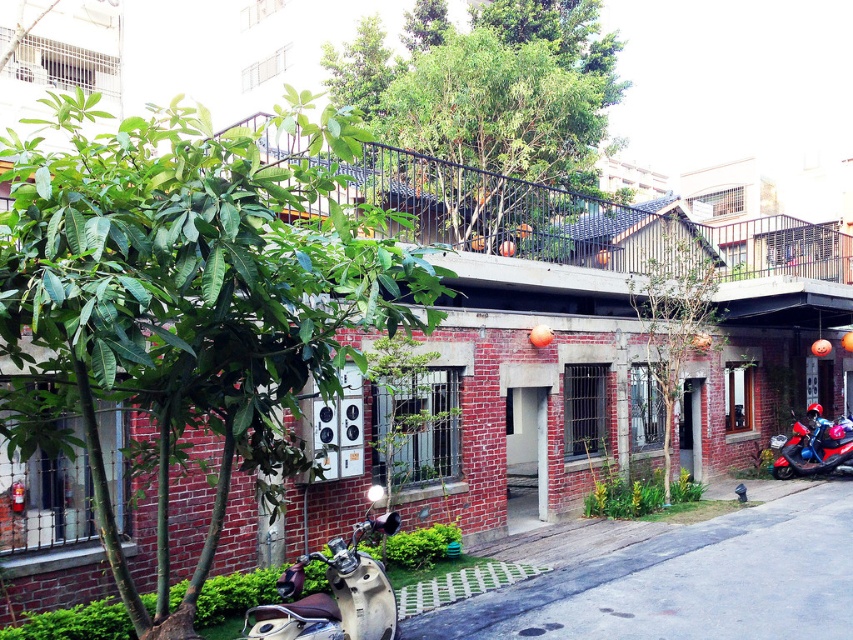
You are a delivery person trying to park your beige leather motorcycle at lower left near the curb. There is a green leafy tree at upper center blocking the path. Can you move the motorcycle to the right to avoid the tree?

The green leafy tree at upper center is positioned on the right side of beige leather motorcycle at lower left, so moving the motorcycle to the right would bring it closer to the tree, not away from it. You should move the motorcycle to the left instead to avoid the tree.

You are a delivery person who needs to park your vehicle between the beige leather motorcycle at lower left and the shiny blue motorcycle at lower right. Given that your delivery van is 2 meters wide, can you fit it between them without moving either motorcycle?

The beige leather motorcycle at lower left occupies less space than the shiny blue motorcycle at lower right. However, the total space between them is not specified. Therefore, it is uncertain whether the 2 meter wide delivery van can fit between them without moving either motorcycle.

You are a delivery person needing to park your motorcycle between the beige leather motorcycle at lower left and the shiny blue motorcycle at lower right. The parking space between them is 11.15 meters. Can your motorcycle, which is 2.5 meters long, fit in this space?

The parking space between the beige leather motorcycle at lower left and the shiny blue motorcycle at lower right is 11.15 meters. Since your motorcycle is only 2.5 meters long, it can easily fit in the available space.